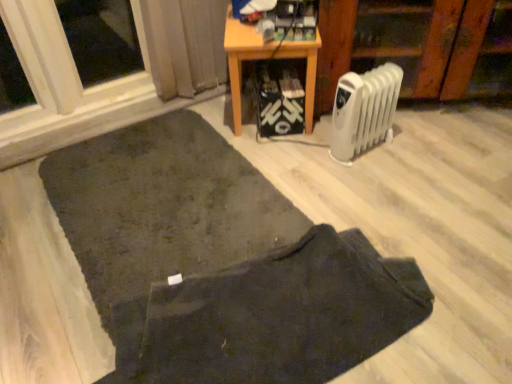
Question: Considering the positions of dark fabric doormat at lower center and white plastic radiator at lower right in the image, is dark fabric doormat at lower center wider or thinner than white plastic radiator at lower right?

Choices:
 (A) wide
 (B) thin

Answer: (A)

Question: Would you say dark fabric doormat at lower center is to the left or to the right of white plastic radiator at lower right in the picture?

Choices:
 (A) right
 (B) left

Answer: (B)

Question: Which is farther from the wooden table at center?

Choices:
 (A) dark fabric mat at lower center
 (B) white plastic radiator at center-right
 (C) dark fabric doormat at lower center
 (D) white plastic radiator at lower right

Answer: (C)

Question: Which of these objects is positioned closest to the dark fabric mat at lower center?

Choices:
 (A) white plastic radiator at lower right
 (B) dark fabric doormat at lower center
 (C) white plastic radiator at center-right
 (D) wooden table at center

Answer: (B)